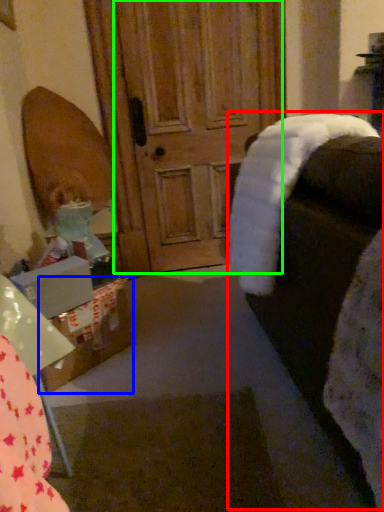
Question: Which object is positioned closest to rocking chair (highlighted by a red box)? Select from cardboard box (highlighted by a blue box) and screen door (highlighted by a green box).

Choices:
 (A) cardboard box
 (B) screen door

Answer: (A)